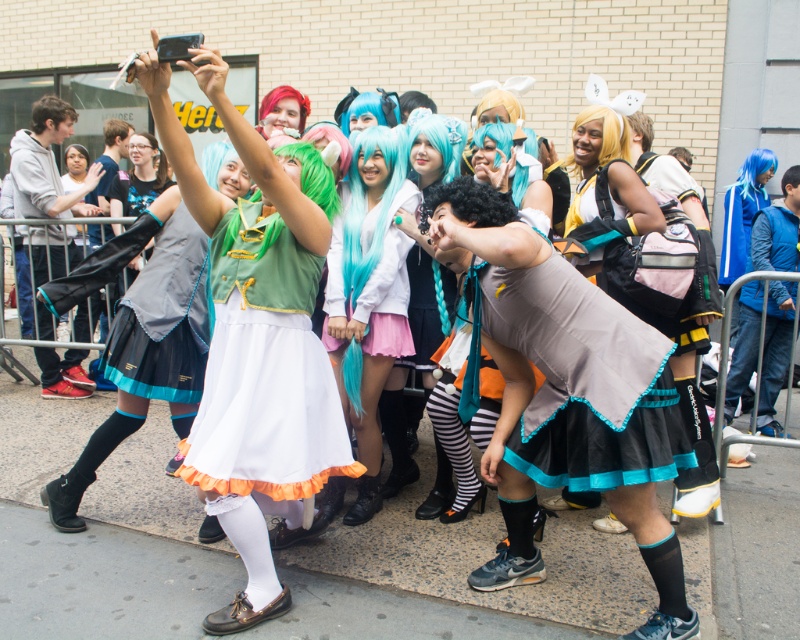
Question: Is teal matte wig at center bigger than matte black skirt at center?

Choices:
 (A) yes
 (B) no

Answer: (A)

Question: Is teal fabric wig at center closer to the viewer compared to blonde synthetic wig at center?

Choices:
 (A) no
 (B) yes

Answer: (B)

Question: Among these objects, which one is nearest to the camera?

Choices:
 (A) matte green dress at center
 (B) matte gray dress at center

Answer: (B)

Question: Which of the following is the closest to the observer?

Choices:
 (A) (72, 156)
 (B) (60, 374)

Answer: (B)

Question: Which of the following is the closest to the observer?

Choices:
 (A) (436, 268)
 (B) (308, 177)

Answer: (B)

Question: Is teal fabric wig at center below matte black skirt at center?

Choices:
 (A) no
 (B) yes

Answer: (B)